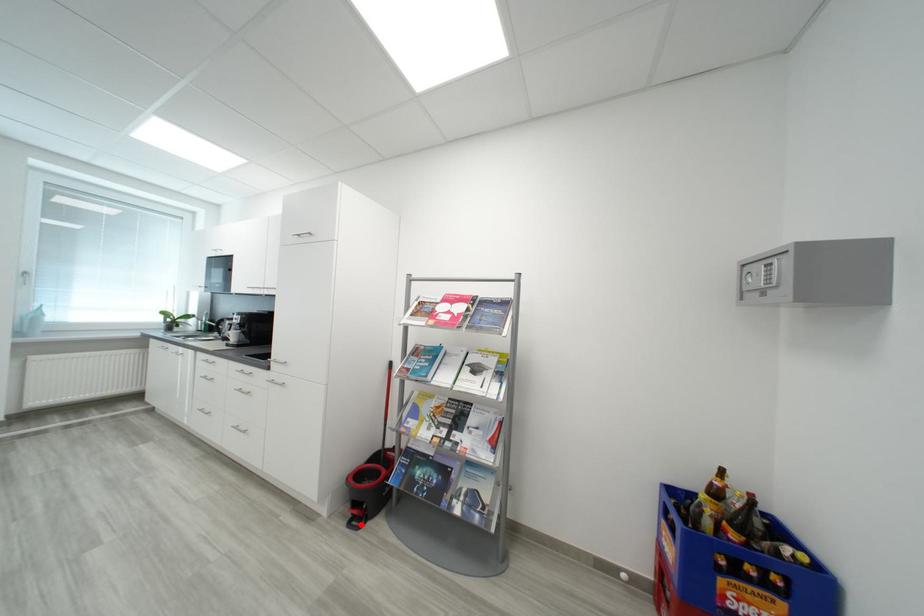
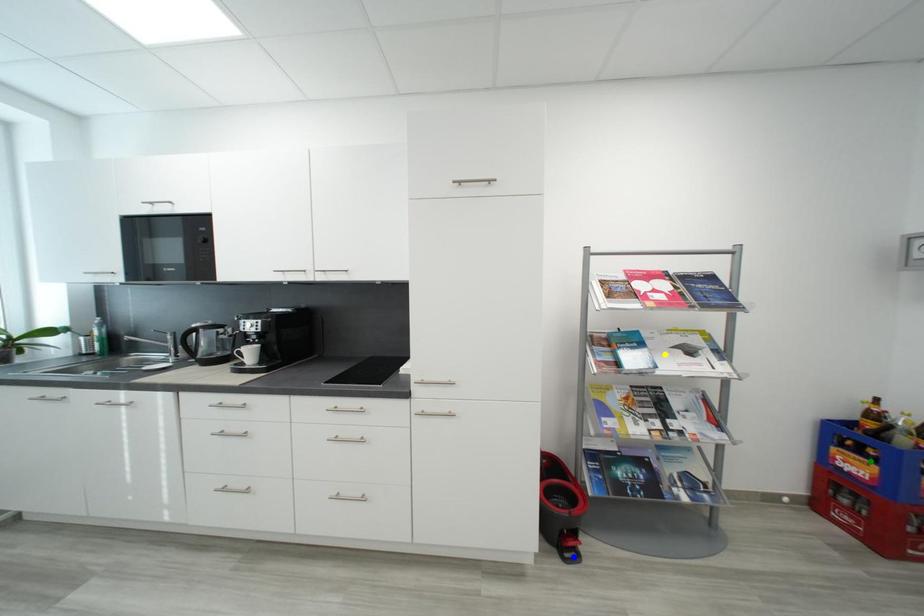
Question: I am providing you with two images of the same scene from different viewpoints. A red point is marked on the first image. You are given multiple points on the second image. Which mark in image 2 goes with the point in image 1?

Choices:
 (A) yellow point
 (B) blue point
 (C) green point

Answer: (B)